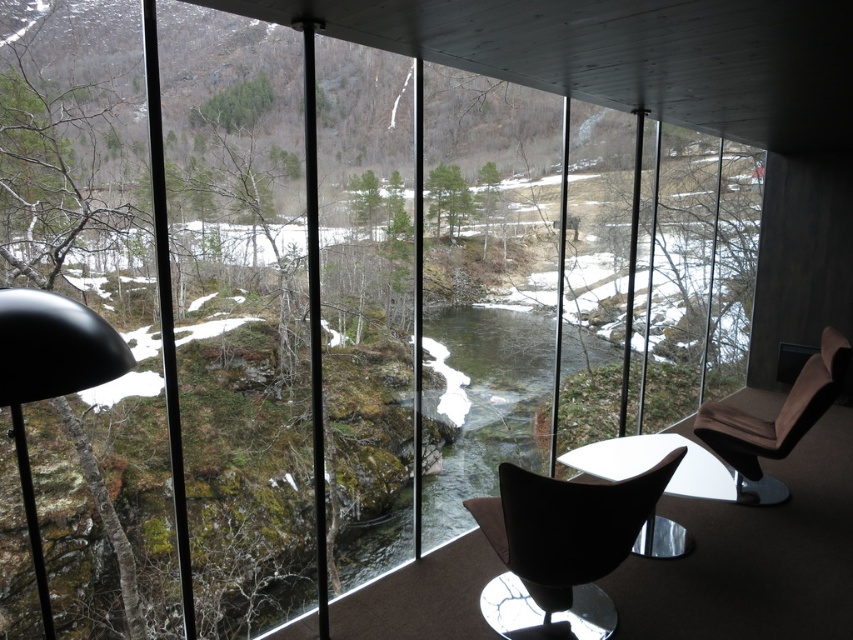
Question: Which object appears closest to the camera in this image?

Choices:
 (A) matte black swivel chair at center
 (B) matte black lamp at left

Answer: (B)

Question: Where is matte black swivel chair at center located in relation to matte black lamp at left in the image?

Choices:
 (A) below
 (B) above

Answer: (A)

Question: Which of the following is the farthest from the observer?

Choices:
 (A) velvet brown armchair at right
 (B) matte black lamp at left
 (C) matte black swivel chair at center

Answer: (A)

Question: Considering the relative positions of matte black lamp at left and velvet brown armchair at right in the image provided, where is matte black lamp at left located with respect to velvet brown armchair at right?

Choices:
 (A) right
 (B) left

Answer: (B)

Question: Which point is closer to the camera taking this photo?

Choices:
 (A) (109, 355)
 (B) (509, 529)

Answer: (A)

Question: Is matte black swivel chair at center above velvet brown armchair at right?

Choices:
 (A) no
 (B) yes

Answer: (A)